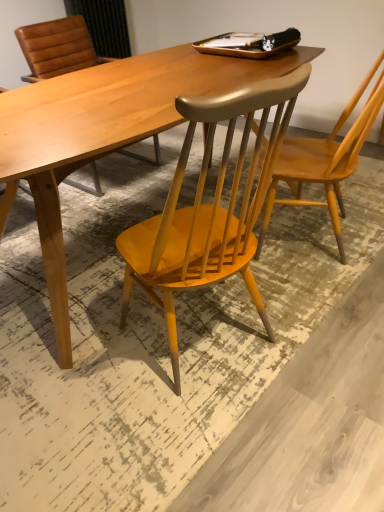
Question: Should I look upward or downward to see light brown wood chair at upper right, the second chair from the left?

Choices:
 (A) up
 (B) down

Answer: (A)

Question: Is wooden chair at center, which is the second chair in right-to-left order, to the left of light brown wood chair at upper right, arranged as the 1th chair when viewed from the right, from the viewer's perspective?

Choices:
 (A) yes
 (B) no

Answer: (A)

Question: Would you consider wooden chair at center, which appears as the first chair when viewed from the left, to be distant from light brown wood chair at upper right, the second chair from the left?

Choices:
 (A) no
 (B) yes

Answer: (A)

Question: From a real-world perspective, is wooden chair at center, which is the second chair in right-to-left order, located beneath light brown wood chair at upper right, the second chair from the left?

Choices:
 (A) no
 (B) yes

Answer: (B)

Question: Is light brown wood chair at upper right, arranged as the 1th chair when viewed from the right, completely or partially inside wooden chair at center, which is the second chair in right-to-left order?

Choices:
 (A) no
 (B) yes

Answer: (A)

Question: Can you confirm if wooden chair at center, which is the second chair in right-to-left order, is taller than light brown wood chair at upper right, the second chair from the left?

Choices:
 (A) no
 (B) yes

Answer: (A)

Question: Can you confirm if wooden chair at center, which appears as the first chair when viewed from the left, is positioned to the right of light brown wood chair at upper right, arranged as the 1th chair when viewed from the right?

Choices:
 (A) yes
 (B) no

Answer: (B)

Question: Could you tell me if light brown wood chair at upper right, arranged as the 1th chair when viewed from the right, is facing wooden chair at center, which appears as the first chair when viewed from the left?

Choices:
 (A) no
 (B) yes

Answer: (B)

Question: Is light brown wood chair at upper right, arranged as the 1th chair when viewed from the right, thinner than wooden chair at center, which is the second chair in right-to-left order?

Choices:
 (A) no
 (B) yes

Answer: (B)

Question: Is light brown wood chair at upper right, the second chair from the left, bigger than wooden chair at center, which appears as the first chair when viewed from the left?

Choices:
 (A) yes
 (B) no

Answer: (B)

Question: Can you see light brown wood chair at upper right, the second chair from the left, touching wooden chair at center, which is the second chair in right-to-left order?

Choices:
 (A) no
 (B) yes

Answer: (A)

Question: Considering the relative positions of light brown wood chair at upper right, arranged as the 1th chair when viewed from the right, and wooden chair at center, which appears as the first chair when viewed from the left, in the image provided, is light brown wood chair at upper right, arranged as the 1th chair when viewed from the right, to the right of wooden chair at center, which appears as the first chair when viewed from the left, from the viewer's perspective?

Choices:
 (A) yes
 (B) no

Answer: (A)

Question: From a real-world perspective, is light brown wood chair at upper right, the second chair from the left, beneath wooden chair at center, which appears as the first chair when viewed from the left?

Choices:
 (A) no
 (B) yes

Answer: (A)

Question: From a real-world perspective, is wooden chair at center, which appears as the first chair when viewed from the left, physically located above or below light brown wood chair at upper right, arranged as the 1th chair when viewed from the right?

Choices:
 (A) above
 (B) below

Answer: (B)